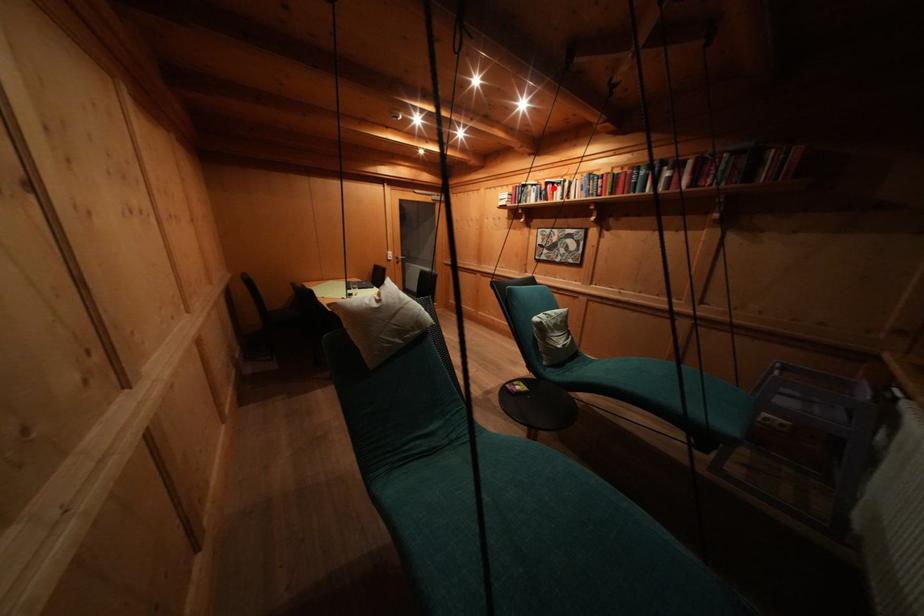
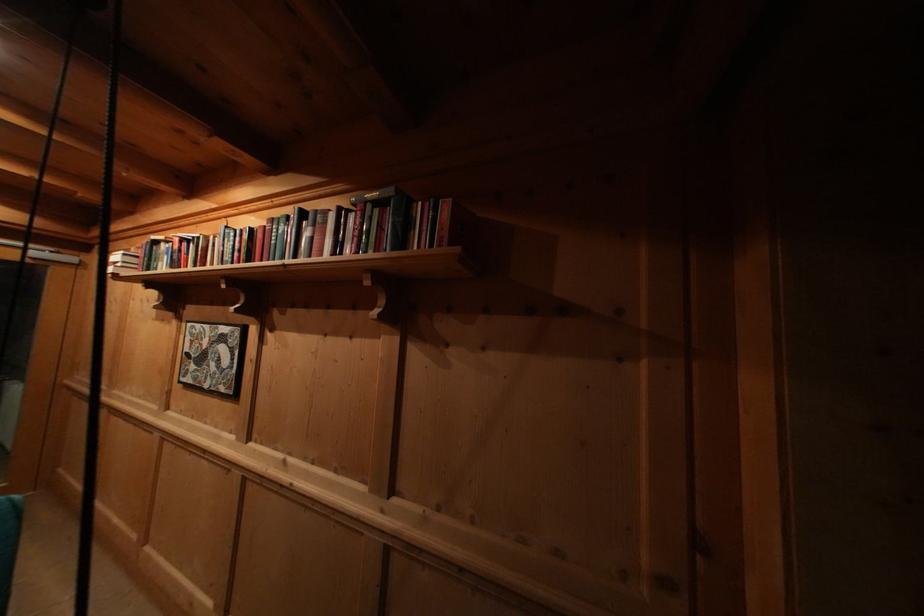
Find the pixel in the second image that matches the highlighted location in the first image.

(188, 246)